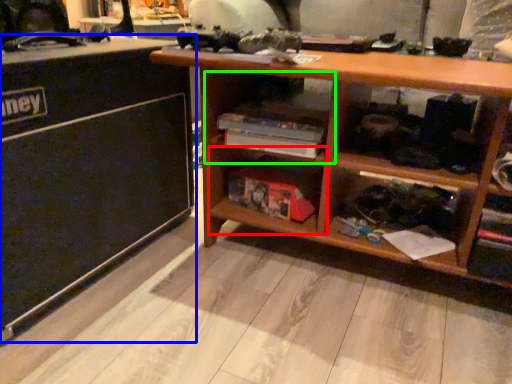
Question: Which object is positioned closest to shelf (highlighted by a red box)? Select from table (highlighted by a blue box) and cabinet (highlighted by a green box).

Choices:
 (A) table
 (B) cabinet

Answer: (B)